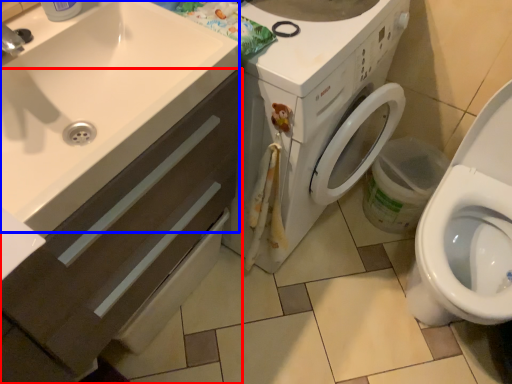
Question: Which object is further to the camera taking this photo, bathroom cabinet (highlighted by a red box) or sink (highlighted by a blue box)?

Choices:
 (A) bathroom cabinet
 (B) sink

Answer: (B)